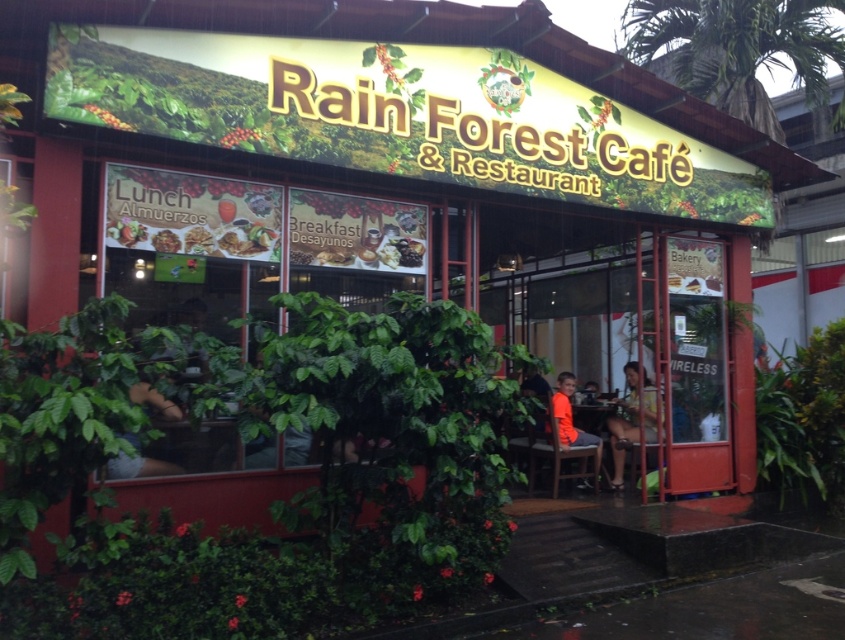
You are a customer looking at the menu board outside the Rain Forest Cafe. You see the green leafy vegetable at center and the smooth glossy coffee bean at center. Which one is wider?

The smooth glossy coffee bean at center is wider than the green leafy vegetable at center.